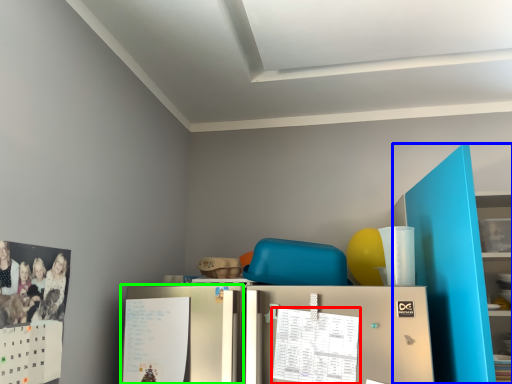
Question: Which object is the closest to the calendar (highlighted by a red box)? Choose among these: bookshelf (highlighted by a blue box) or fridge (highlighted by a green box).

Choices:
 (A) bookshelf
 (B) fridge

Answer: (B)